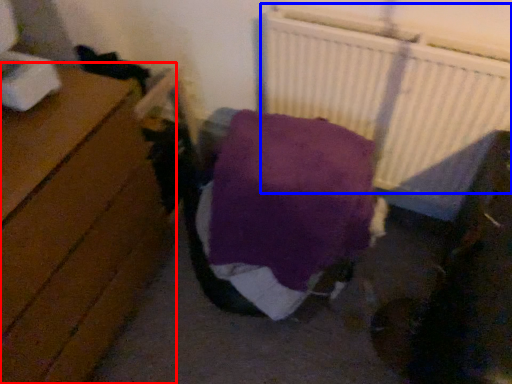
Question: Which of the following is the farthest to the observer, furniture (highlighted by a red box) or radiator (highlighted by a blue box)?

Choices:
 (A) furniture
 (B) radiator

Answer: (B)